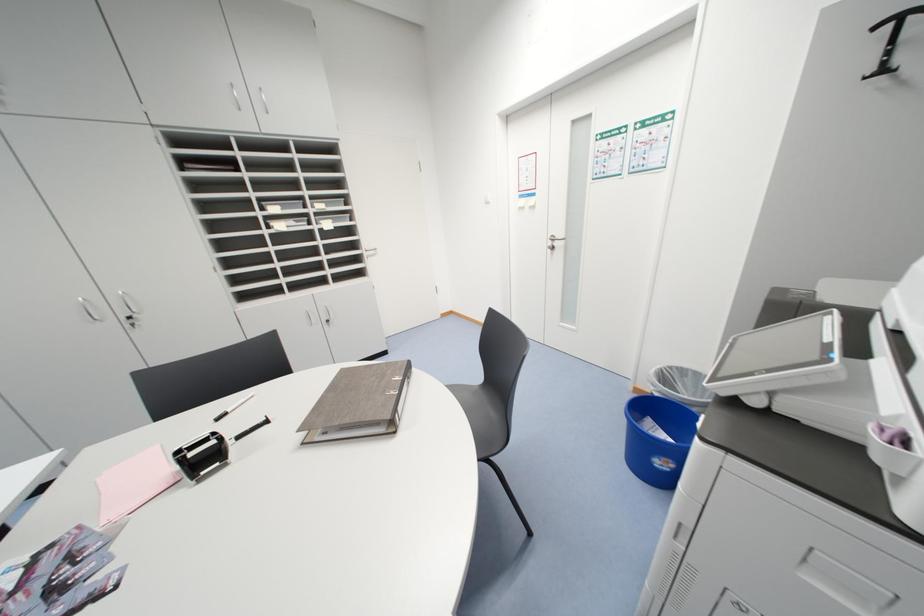
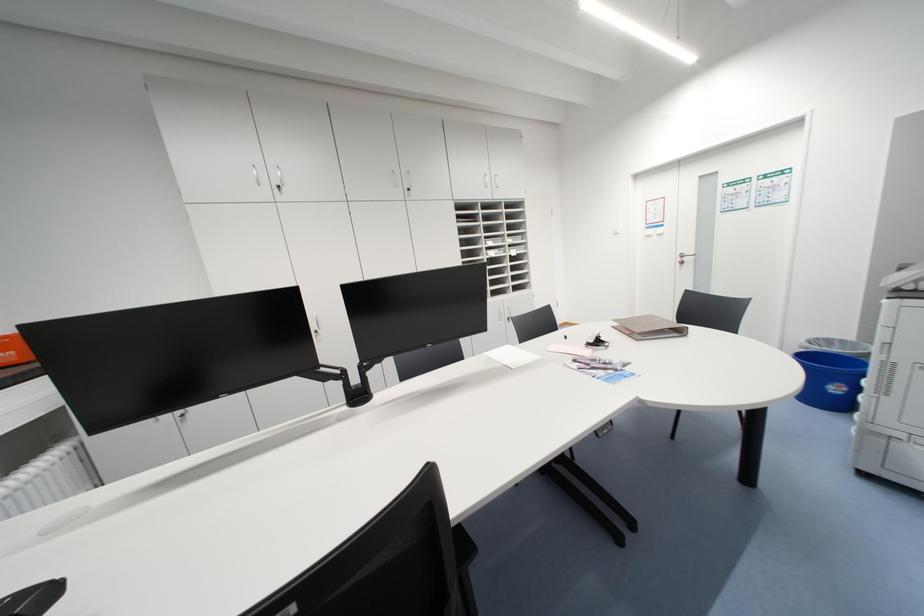
What movement of the cameraman would produce the second image?

The cameraman moved toward left, backward.